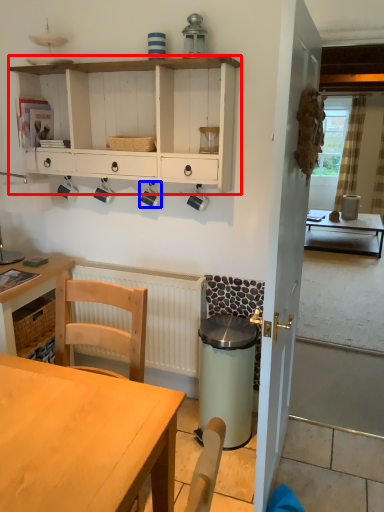
Question: Which of the following is the closest to the observer, cabinetry (highlighted by a red box) or coffee cup (highlighted by a blue box)?

Choices:
 (A) cabinetry
 (B) coffee cup

Answer: (A)